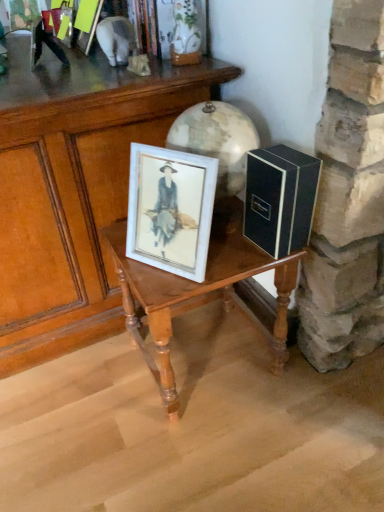
Question: From the image's perspective, is wooden table at center, which is the second table in right-to-left order, on top of metallic silver figurine at upper left?

Choices:
 (A) yes
 (B) no

Answer: (B)

Question: Can you confirm if wooden table at center, which is counted as the 1th table, starting from the left, is positioned to the left of metallic silver figurine at upper left?

Choices:
 (A) yes
 (B) no

Answer: (A)

Question: Is wooden table at center, which is counted as the 1th table, starting from the left, with metallic silver figurine at upper left?

Choices:
 (A) no
 (B) yes

Answer: (A)

Question: Does wooden table at center, which is counted as the 1th table, starting from the left, appear on the right side of metallic silver figurine at upper left?

Choices:
 (A) no
 (B) yes

Answer: (A)

Question: From a real-world perspective, is wooden table at center, which is the second table in right-to-left order, physically below metallic silver figurine at upper left?

Choices:
 (A) yes
 (B) no

Answer: (A)

Question: Based on their positions, is black matte box at right located to the left or right of wooden table at center, marked as the first table in a right-to-left arrangement?

Choices:
 (A) left
 (B) right

Answer: (B)

Question: Considering the positions of black matte box at right and wooden table at center, which ranks as the 2th table in left-to-right order, in the image, is black matte box at right wider or thinner than wooden table at center, which ranks as the 2th table in left-to-right order,?

Choices:
 (A) thin
 (B) wide

Answer: (A)

Question: Considering the positions of black matte box at right and wooden table at center, marked as the first table in a right-to-left arrangement, in the image, is black matte box at right bigger or smaller than wooden table at center, marked as the first table in a right-to-left arrangement,?

Choices:
 (A) big
 (B) small

Answer: (B)

Question: Is black matte box at right in front of or behind wooden table at center, which ranks as the 2th table in left-to-right order, in the image?

Choices:
 (A) front
 (B) behind

Answer: (A)

Question: Considering the relative positions of black matte box at right and metallic silver figurine at upper left in the image provided, is black matte box at right to the left or to the right of metallic silver figurine at upper left?

Choices:
 (A) right
 (B) left

Answer: (A)

Question: From their relative heights in the image, would you say black matte box at right is taller or shorter than metallic silver figurine at upper left?

Choices:
 (A) short
 (B) tall

Answer: (B)

Question: Is black matte box at right wider or thinner than metallic silver figurine at upper left?

Choices:
 (A) wide
 (B) thin

Answer: (B)

Question: From a real-world perspective, is black matte box at right above or below metallic silver figurine at upper left?

Choices:
 (A) below
 (B) above

Answer: (A)

Question: In terms of width, does metallic silver figurine at upper left look wider or thinner when compared to wooden table at center, which ranks as the 2th table in left-to-right order?

Choices:
 (A) wide
 (B) thin

Answer: (B)

Question: Which is correct: metallic silver figurine at upper left is inside wooden table at center, marked as the first table in a right-to-left arrangement, or outside of it?

Choices:
 (A) inside
 (B) outside

Answer: (B)